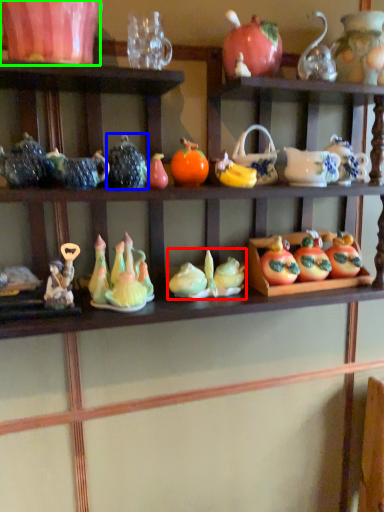
Question: Which is nearer to the toy (highlighted by a red box)? tableware (highlighted by a blue box) or tableware (highlighted by a green box).

Choices:
 (A) tableware
 (B) tableware

Answer: (A)